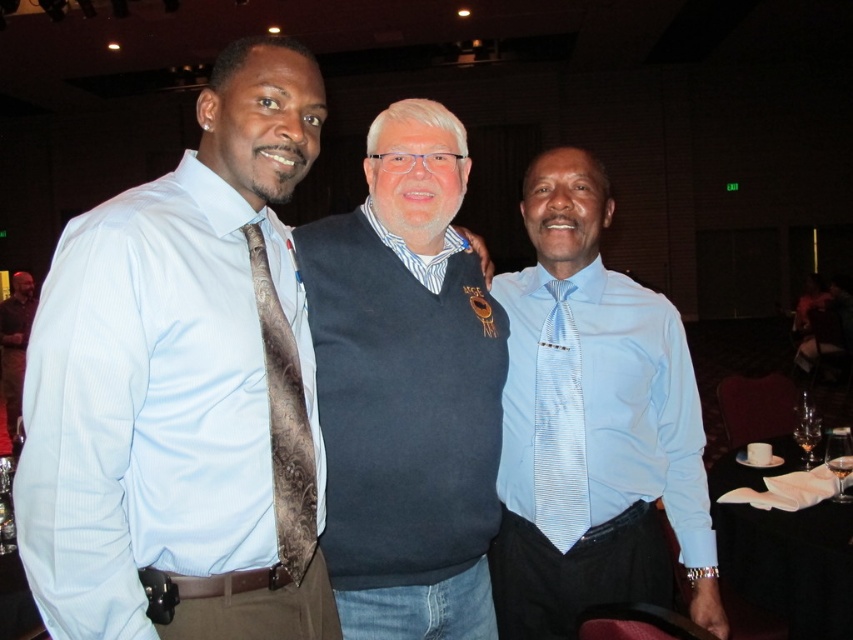
Question: Is light blue striped shirt at right below striped cotton shirt at center?

Choices:
 (A) no
 (B) yes

Answer: (B)

Question: Which object appears closest to the camera in this image?

Choices:
 (A) light blue dress shirt at left
 (B) light blue striped shirt at right
 (C) striped cotton shirt at center

Answer: (A)

Question: Which of these objects is positioned closest to the dark blue sweater at center?

Choices:
 (A) brown leather jacket at left
 (B) light blue dress shirt at left
 (C) light blue striped tie at center
 (D) striped cotton shirt at center

Answer: (D)

Question: Does brown paisley tie at left appear under brown leather jacket at left?

Choices:
 (A) yes
 (B) no

Answer: (B)

Question: Does brown paisley tie at left appear on the right side of brown leather jacket at left?

Choices:
 (A) no
 (B) yes

Answer: (B)

Question: Which of the following is the closest to the observer?

Choices:
 (A) (357, 236)
 (B) (799, 611)

Answer: (A)